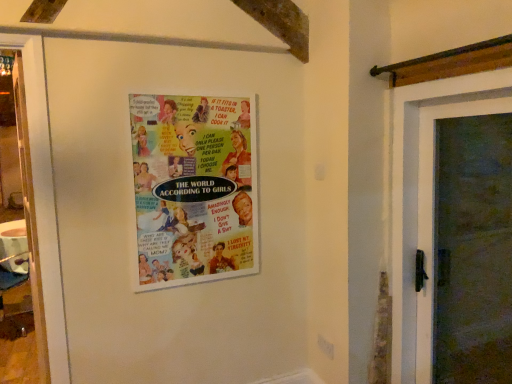
Question: Is multicolored paper poster at center turned away from wooden door at right?

Choices:
 (A) no
 (B) yes

Answer: (A)

Question: From the image's perspective, is multicolored paper poster at center located beneath wooden door at right?

Choices:
 (A) yes
 (B) no

Answer: (B)

Question: Is multicolored paper poster at center further to the viewer compared to wooden door at right?

Choices:
 (A) yes
 (B) no

Answer: (A)

Question: Would you say multicolored paper poster at center is a long distance from wooden door at right?

Choices:
 (A) yes
 (B) no

Answer: (B)

Question: Can you confirm if multicolored paper poster at center is positioned to the right of wooden door at right?

Choices:
 (A) yes
 (B) no

Answer: (B)

Question: Is multicolored paper poster at center placed right next to wooden door at right?

Choices:
 (A) yes
 (B) no

Answer: (B)

Question: Considering the relative sizes of wooden door at right and multicolored paper poster at center in the image provided, is wooden door at right smaller than multicolored paper poster at center?

Choices:
 (A) no
 (B) yes

Answer: (A)

Question: From the image's perspective, does wooden door at right appear lower than multicolored paper poster at center?

Choices:
 (A) yes
 (B) no

Answer: (A)

Question: Is wooden door at right positioned before multicolored paper poster at center?

Choices:
 (A) no
 (B) yes

Answer: (B)

Question: Can you confirm if wooden door at right is taller than multicolored paper poster at center?

Choices:
 (A) yes
 (B) no

Answer: (A)

Question: From a real-world perspective, is wooden door at right positioned under multicolored paper poster at center based on gravity?

Choices:
 (A) no
 (B) yes

Answer: (B)

Question: Considering the relative sizes of wooden door at right and multicolored paper poster at center in the image provided, is wooden door at right shorter than multicolored paper poster at center?

Choices:
 (A) no
 (B) yes

Answer: (A)

Question: Relative to multicolored paper poster at center, is wooden door at right in front or behind?

Choices:
 (A) behind
 (B) front

Answer: (B)